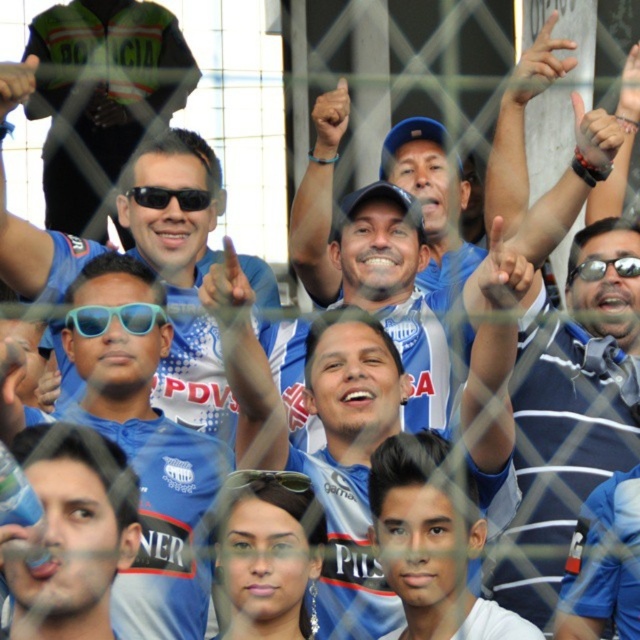
Question: Can you confirm if blue fabric shirt at center is positioned to the right of black plastic sunglasses at center?

Choices:
 (A) no
 (B) yes

Answer: (A)

Question: Among these points, which one is farthest from the camera?

Choices:
 (A) (54, 131)
 (B) (67, 317)
 (C) (173, 198)

Answer: (A)

Question: Where is matte black sunglasses at upper left located in relation to teal plastic sunglasses at center in the image?

Choices:
 (A) above
 (B) below

Answer: (A)

Question: Which point is farther from the camera taking this photo?

Choices:
 (A) (589, 264)
 (B) (93, 305)
 (C) (122, 205)

Answer: (C)

Question: Which of the following is the farthest from the observer?

Choices:
 (A) teal plastic sunglasses at center
 (B) sunglasses at center
 (C) black plastic sunglasses at center
 (D) matte black sunglasses at upper left

Answer: (D)

Question: Does blue fabric shirt at center have a lesser width compared to black plastic sunglasses at center?

Choices:
 (A) no
 (B) yes

Answer: (A)